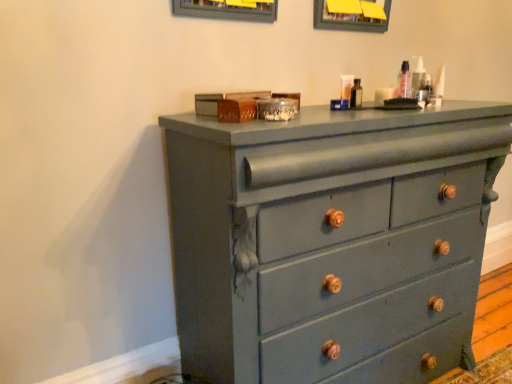
Question: Considering the relative sizes of matte gray dresser at center and matte plastic container at upper right in the image provided, is matte gray dresser at center smaller than matte plastic container at upper right?

Choices:
 (A) no
 (B) yes

Answer: (A)

Question: Is matte gray dresser at center shorter than matte plastic container at upper right?

Choices:
 (A) yes
 (B) no

Answer: (B)

Question: Can you confirm if matte gray dresser at center is taller than matte plastic container at upper right?

Choices:
 (A) no
 (B) yes

Answer: (B)

Question: Is matte gray dresser at center further to camera compared to matte plastic container at upper right?

Choices:
 (A) yes
 (B) no

Answer: (B)

Question: Could matte plastic container at upper right be considered to be inside matte gray dresser at center?

Choices:
 (A) no
 (B) yes

Answer: (A)

Question: Would you say matte gray dresser at center is to the left or to the right of matte gray picture frame at upper center in the picture?

Choices:
 (A) left
 (B) right

Answer: (A)

Question: From a real-world perspective, is matte gray dresser at center positioned above or below matte gray picture frame at upper center?

Choices:
 (A) above
 (B) below

Answer: (B)

Question: Is matte gray dresser at center taller or shorter than matte gray picture frame at upper center?

Choices:
 (A) tall
 (B) short

Answer: (A)

Question: From the image's perspective, is matte gray dresser at center above or below matte gray picture frame at upper center?

Choices:
 (A) below
 (B) above

Answer: (A)

Question: Is matte gray picture frame at upper center to the left or to the right of matte gray dresser at center in the image?

Choices:
 (A) left
 (B) right

Answer: (B)

Question: From their relative heights in the image, would you say matte gray picture frame at upper center is taller or shorter than matte gray dresser at center?

Choices:
 (A) short
 (B) tall

Answer: (A)

Question: In the image, is matte gray picture frame at upper center positioned in front of or behind matte gray dresser at center?

Choices:
 (A) front
 (B) behind

Answer: (B)

Question: From the image's perspective, is matte gray picture frame at upper center above or below matte gray dresser at center?

Choices:
 (A) above
 (B) below

Answer: (A)

Question: Choose the correct answer: Is matte gray picture frame at upper center inside matte plastic container at upper right or outside it?

Choices:
 (A) inside
 (B) outside

Answer: (B)

Question: In terms of size, does matte gray picture frame at upper center appear bigger or smaller than matte plastic container at upper right?

Choices:
 (A) big
 (B) small

Answer: (A)